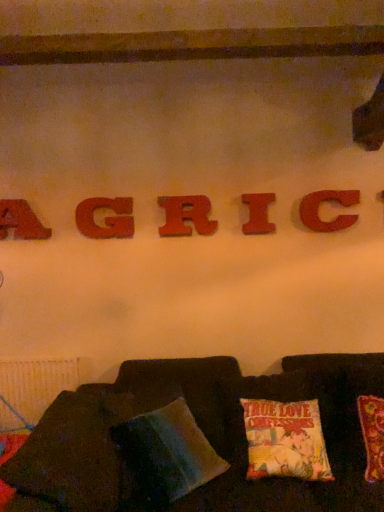
Question: Is velvet cushion at lower center surrounding wooden letter r at center, the 3th letter from the left?

Choices:
 (A) yes
 (B) no

Answer: (B)

Question: Is velvet cushion at lower center completely or partially outside of wooden letter r at center, the third letter from the right?

Choices:
 (A) no
 (B) yes

Answer: (B)

Question: From a real-world perspective, is velvet cushion at lower center physically above wooden letter r at center, the 3th letter from the left?

Choices:
 (A) yes
 (B) no

Answer: (B)

Question: Is velvet cushion at lower center bigger than wooden letter r at center, the third letter from the right?

Choices:
 (A) yes
 (B) no

Answer: (A)

Question: Does velvet cushion at lower center appear on the left side of wooden letter r at center, the 3th letter from the left?

Choices:
 (A) yes
 (B) no

Answer: (B)

Question: Is matte wooden letter g at center, which is counted as the 4th letter, starting from the right, spatially inside wooden letter c at center, which ranks as the fifth letter in left-to-right order, or outside of it?

Choices:
 (A) inside
 (B) outside

Answer: (B)

Question: In the image, is matte wooden letter g at center, which is counted as the 4th letter, starting from the right, positioned in front of or behind wooden letter c at center, which is the 1th letter in right-to-left order?

Choices:
 (A) front
 (B) behind

Answer: (B)

Question: In terms of width, does matte wooden letter g at center, marked as the second letter in a left-to-right arrangement, look wider or thinner when compared to wooden letter c at center, which is the 1th letter in right-to-left order?

Choices:
 (A) thin
 (B) wide

Answer: (B)

Question: From the image's perspective, is matte wooden letter g at center, which is counted as the 4th letter, starting from the right, positioned above or below wooden letter c at center, which ranks as the fifth letter in left-to-right order?

Choices:
 (A) above
 (B) below

Answer: (B)

Question: In the image, is wooden letter a at upper left, the 5th letter in the right-to-left sequence, positioned in front of or behind matte wood letter i at center, which appears as the 2th letter when viewed from the right?

Choices:
 (A) front
 (B) behind

Answer: (B)

Question: Is wooden letter a at upper left, the first letter viewed from the left, taller or shorter than matte wood letter i at center, which appears as the 2th letter when viewed from the right?

Choices:
 (A) tall
 (B) short

Answer: (A)

Question: Does point (18, 230) appear closer or farther from the camera than point (248, 204)?

Choices:
 (A) farther
 (B) closer

Answer: (A)

Question: Looking at the image, does wooden letter a at upper left, the 5th letter in the right-to-left sequence, seem bigger or smaller compared to matte wood letter i at center, the fourth letter when ordered from left to right?

Choices:
 (A) big
 (B) small

Answer: (A)

Question: Relative to multicolored fabric pillow at lower center, is wooden letter a at upper left, the 5th letter in the right-to-left sequence, in front or behind?

Choices:
 (A) behind
 (B) front

Answer: (A)

Question: In the image, is wooden letter a at upper left, the first letter viewed from the left, on the left side or the right side of multicolored fabric pillow at lower center?

Choices:
 (A) right
 (B) left

Answer: (B)